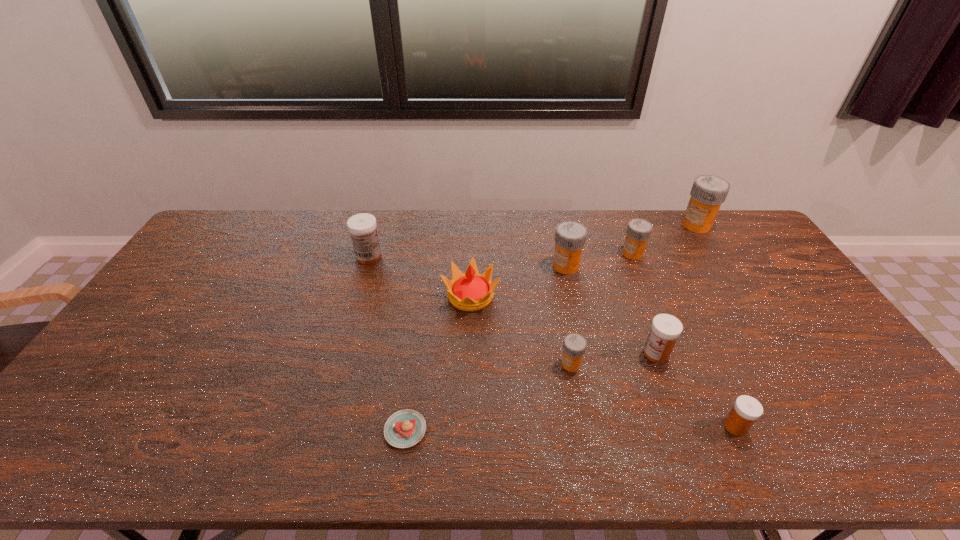
Where is `object that is the third closest one to the third biggest orange medicine`? Image resolution: width=960 pixels, height=540 pixels. object that is the third closest one to the third biggest orange medicine is located at coordinates (665, 329).

The height and width of the screenshot is (540, 960). I want to click on medicine that is the second closest to the third biggest orange medicine, so click(x=708, y=192).

Where is `the fifth closest medicine to the second white medicine from right to left`? Image resolution: width=960 pixels, height=540 pixels. the fifth closest medicine to the second white medicine from right to left is located at coordinates pos(708,192).

Where is `the third closest orange medicine relative to the nearest white medicine`? The height and width of the screenshot is (540, 960). the third closest orange medicine relative to the nearest white medicine is located at coordinates (638, 231).

Identify the location of orange medicine that stands as the closest to the yellow crown. (570, 237).

This screenshot has width=960, height=540. I want to click on white medicine that is the closest one to the second nearest white medicine, so click(746, 410).

Identify the location of white medicine that can be found as the third closest to the second object from left to right. The width and height of the screenshot is (960, 540). (746, 410).

You are a GUI agent. You are given a task and a screenshot of the screen. Output one action in this format:
    pyautogui.click(x=<x>, y=<y>)
    Task: Click on the vacant area that satisfies the following two spatial constraints: 1. on the back side of the second object from right to left; 2. on the label side of the second biggest orange medicine
    
    Given the screenshot: What is the action you would take?
    pyautogui.click(x=660, y=266)

Locate an element on the screen. The height and width of the screenshot is (540, 960). free region that satisfies the following two spatial constraints: 1. on the back side of the eighth object from right to left; 2. on the left side of the second biggest white medicine is located at coordinates (416, 353).

Where is `vacant area that satisfies the following two spatial constraints: 1. on the label side of the rightmost white medicine; 2. on the right side of the third orange medicine from left to right`? The image size is (960, 540). vacant area that satisfies the following two spatial constraints: 1. on the label side of the rightmost white medicine; 2. on the right side of the third orange medicine from left to right is located at coordinates (703, 427).